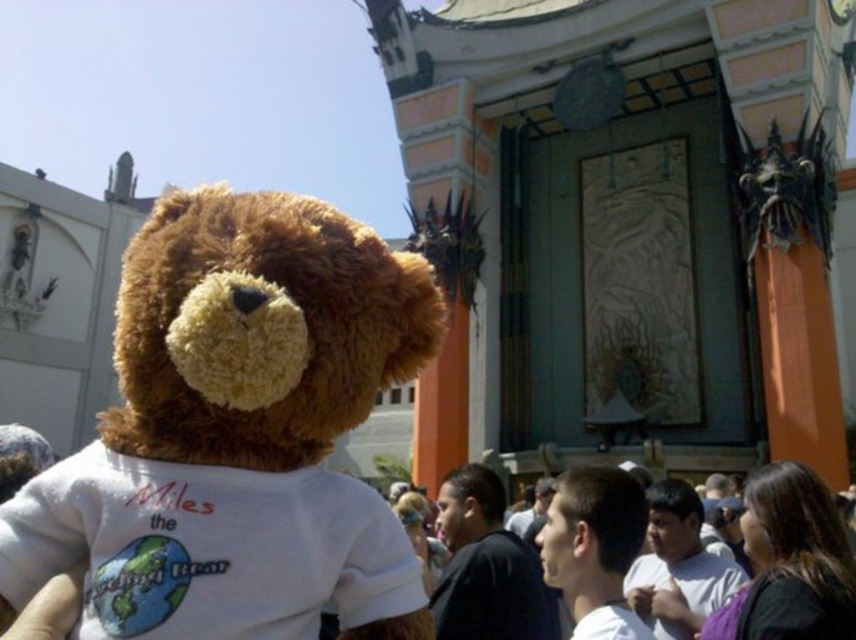
Between soft brown teddy bear at center and dark brown hair at center, which one appears on the right side from the viewer's perspective?

From the viewer's perspective, dark brown hair at center appears more on the right side.

Can you confirm if soft brown teddy bear at center is wider than dark brown hair at center?

Indeed, soft brown teddy bear at center has a greater width compared to dark brown hair at center.

Which is in front, point (340, 282) or point (788, 513)?

Positioned in front is point (340, 282).

Locate an element on the screen. soft brown teddy bear at center is located at coordinates (236, 433).